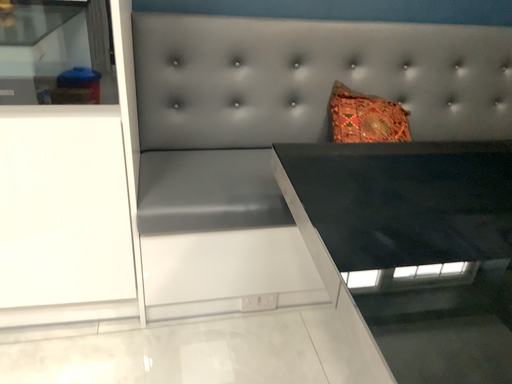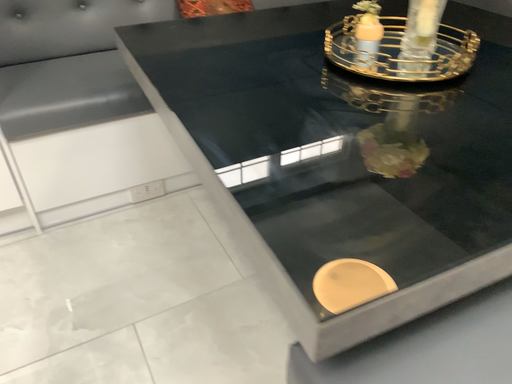
Question: How did the camera likely rotate when shooting the video?

Choices:
 (A) rotated downward
 (B) rotated upward

Answer: (A)